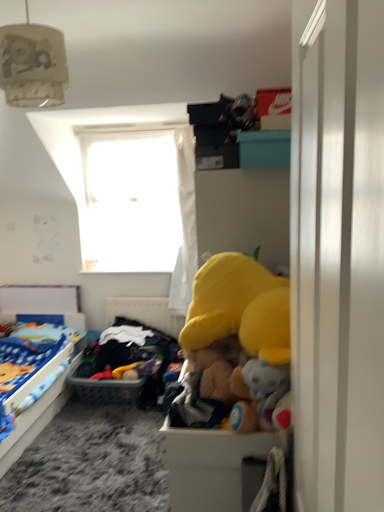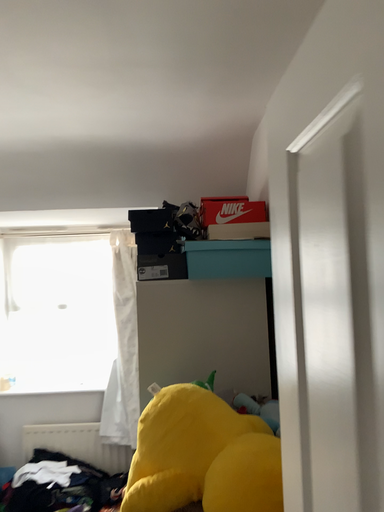
Question: Which way did the camera rotate in the video?

Choices:
 (A) rotated left
 (B) rotated right

Answer: (B)